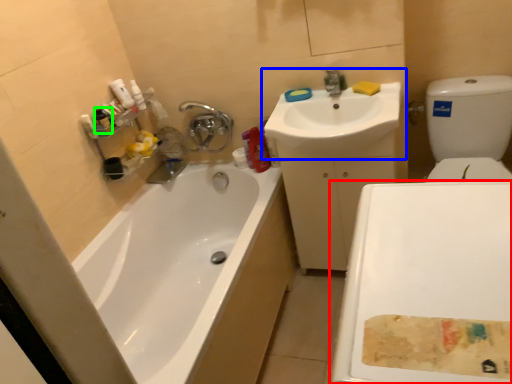
Question: Which is nearer to the plain (highlighted by a red box)? sink (highlighted by a blue box) or mouthwash (highlighted by a green box).

Choices:
 (A) sink
 (B) mouthwash

Answer: (A)